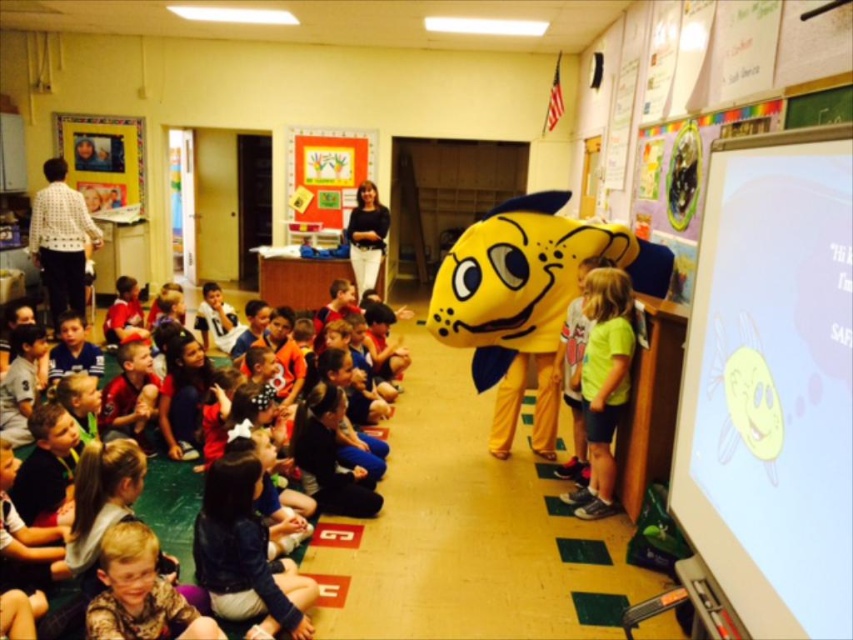
Is green matte shirt at center to the left of light brown hair at lower left from the viewer's perspective?

Incorrect, green matte shirt at center is not on the left side of light brown hair at lower left.

Identify the location of green matte shirt at center. (602, 381).

Which of these two, light brown hair at lower left or matte black shirt at lower left, stands taller?

matte black shirt at lower left

Can you confirm if light brown hair at lower left is bigger than matte black shirt at lower left?

No, light brown hair at lower left is not bigger than matte black shirt at lower left.

This screenshot has height=640, width=853. I want to click on light brown hair at lower left, so click(140, 593).

The image size is (853, 640). I want to click on light brown hair at lower left, so click(x=140, y=593).

What do you see at coordinates (140, 593) in the screenshot?
I see `light brown hair at lower left` at bounding box center [140, 593].

The width and height of the screenshot is (853, 640). Identify the location of light brown hair at lower left. (140, 593).